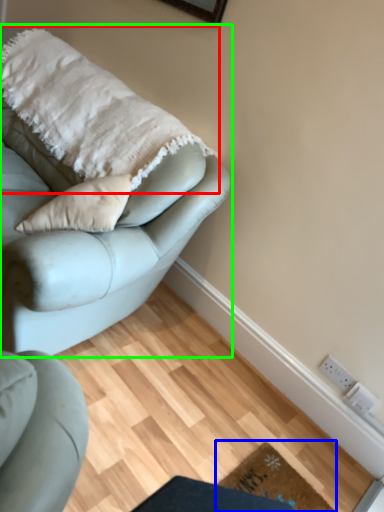
Question: Which object is positioned farthest from blanket (highlighted by a red box)? Select from doormat (highlighted by a blue box) and studio couch (highlighted by a green box).

Choices:
 (A) doormat
 (B) studio couch

Answer: (A)